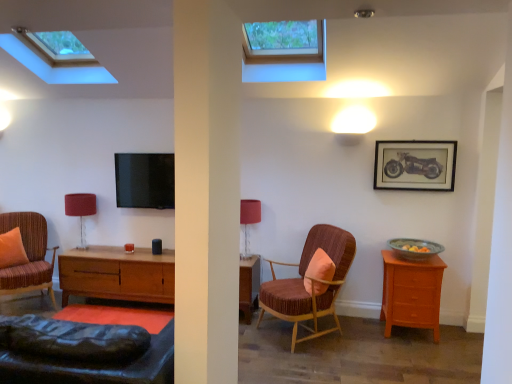
Locate an element on the screen. free point above wooden framed motorcycle print at upper right (from a real-world perspective) is located at coordinates (420, 143).